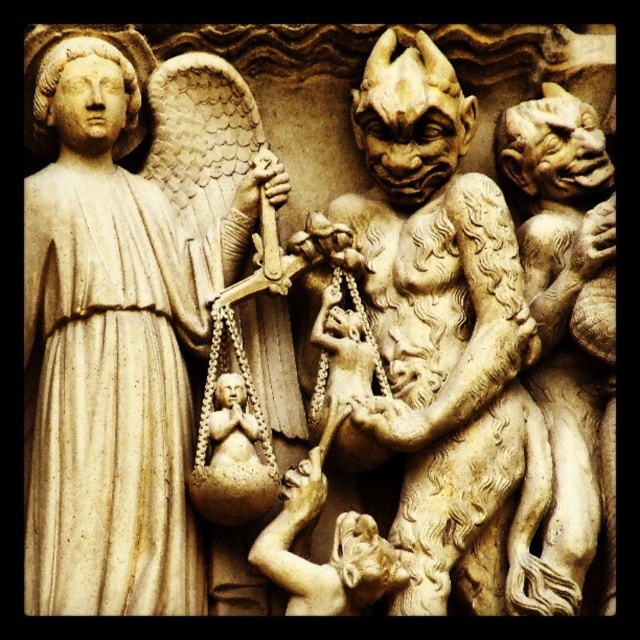
Can you confirm if matte stone angel at left is positioned below beige stone gargoyle at right?

Correct, matte stone angel at left is located below beige stone gargoyle at right.

Who is taller, matte stone angel at left or beige stone gargoyle at right?

matte stone angel at left

Image resolution: width=640 pixels, height=640 pixels. I want to click on matte stone angel at left, so click(113, 339).